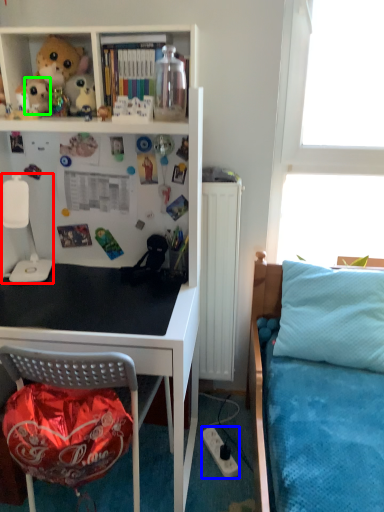
Question: Which object is the closest to the lamp (highlighted by a red box)? Choose among these: power outlet (highlighted by a blue box) or toy (highlighted by a green box).

Choices:
 (A) power outlet
 (B) toy

Answer: (B)